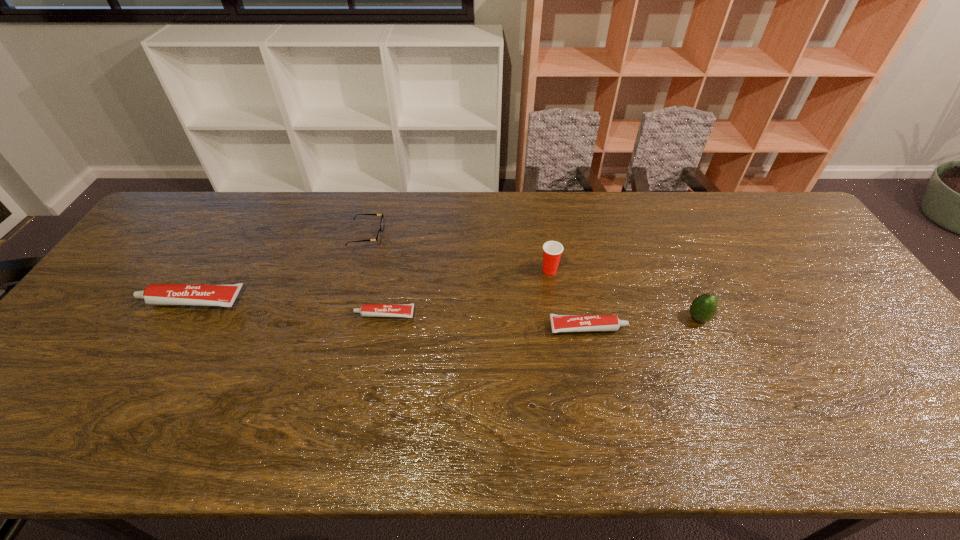
Given the evenly spaced toothpastes in the image, where should an extra toothpaste be added on the right to preserve the spacing? Please point to a vacant space. Please provide its 2D coordinates. Your answer should be formatted as a tuple, i.e. [(x, y)], where the tuple contains the x and y coordinates of a point satisfying the conditions above.

[(804, 342)]